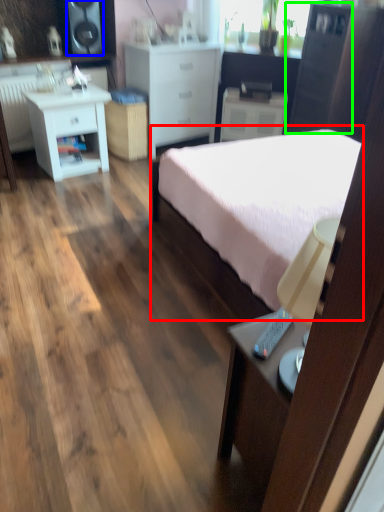
Question: Which object is positioned farthest from bed (highlighted by a red box)? Select from speaker (highlighted by a blue box) and cabinetry (highlighted by a green box).

Choices:
 (A) speaker
 (B) cabinetry

Answer: (A)